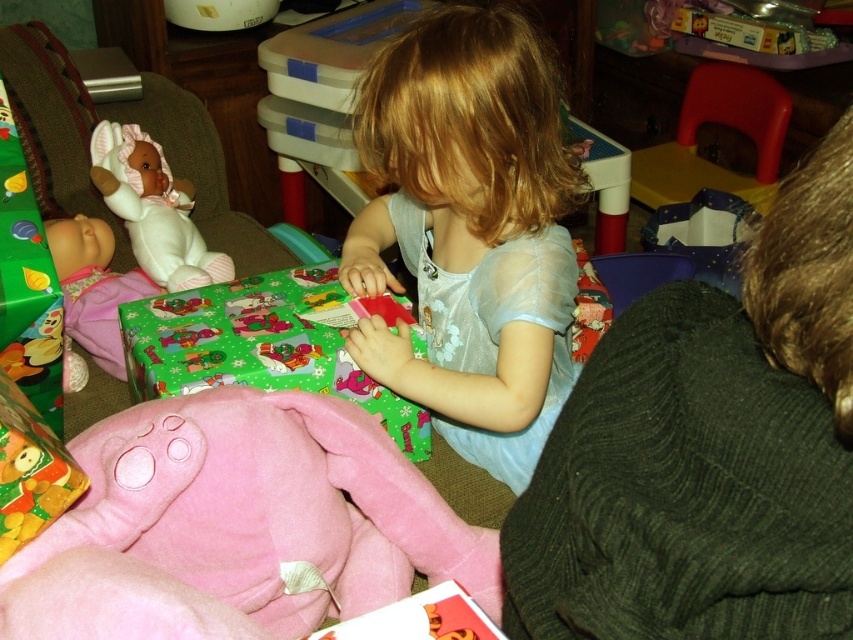
Can you confirm if white plush doll at left is wider than white plush baby doll at left?

Yes, white plush doll at left is wider than white plush baby doll at left.

Where is `white plush doll at left`? white plush doll at left is located at coordinates (154, 209).

Is pink plush pig at lower left closer to camera compared to white plush baby doll at left?

Yes.

Is point (157, 608) farther from camera compared to point (64, 256)?

No.

This screenshot has height=640, width=853. What do you see at coordinates (239, 525) in the screenshot? I see `pink plush pig at lower left` at bounding box center [239, 525].

Where is `pink plush pig at lower left`? The width and height of the screenshot is (853, 640). pink plush pig at lower left is located at coordinates (239, 525).

Which of these two, pink plush pig at lower left or green glossy wrapping paper at center, stands shorter?

pink plush pig at lower left

Who is taller, pink plush pig at lower left or green glossy wrapping paper at center?

With more height is green glossy wrapping paper at center.

Identify the location of pink plush pig at lower left. (239, 525).

Find the location of a particular element. This screenshot has width=853, height=640. pink plush pig at lower left is located at coordinates (239, 525).